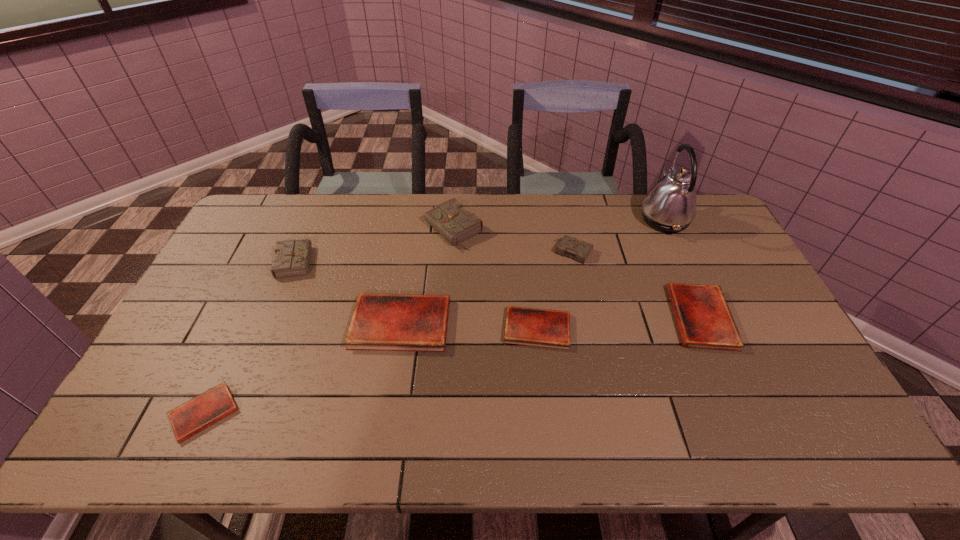
Locate an element on the screen. free space between the second shortest diary and the second green diary from left to right is located at coordinates (495, 279).

This screenshot has height=540, width=960. What are the coordinates of `vacant region between the second red diary from right to left and the second tallest object` in the screenshot? It's located at (495, 279).

At what (x,y) coordinates should I click in order to perform the action: click on empty location between the biggest red diary and the tallest object. Please return your answer as a coordinate pair (x, y). Image resolution: width=960 pixels, height=540 pixels. Looking at the image, I should click on (533, 271).

Identify the location of vacant space that is in between the sixth shortest diary and the rightmost red diary. The image size is (960, 540). (498, 288).

Locate an element on the screen. This screenshot has height=540, width=960. free area in between the tallest object and the third shortest diary is located at coordinates (683, 268).

This screenshot has width=960, height=540. In order to click on free spot between the second shortest diary and the leftmost green diary in this screenshot , I will do `click(417, 294)`.

Identify the location of vacant area between the sixth tallest object and the smallest green diary. (637, 285).

Locate an element on the screen. This screenshot has width=960, height=540. empty location between the third shortest diary and the third red diary from left to right is located at coordinates (619, 323).

The height and width of the screenshot is (540, 960). In order to click on unoccupied position between the sixth tallest object and the tallest object in this screenshot , I will do `click(683, 268)`.

Point out which object is positioned as the fourth nearest to the fourth tallest diary. Please provide its 2D coordinates. Your answer should be formatted as a tuple, i.e. [(x, y)], where the tuple contains the x and y coordinates of a point satisfying the conditions above.

[(204, 410)]